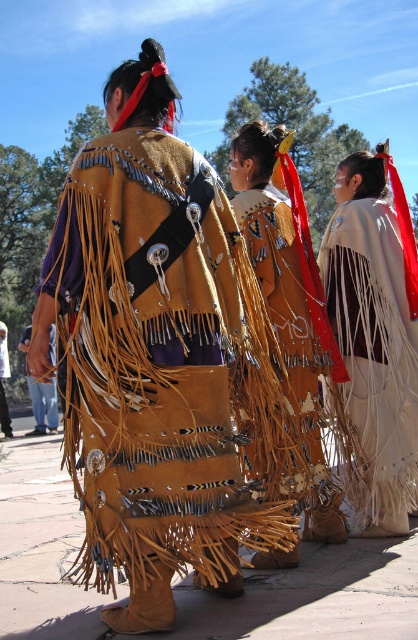
You are standing in front of the scene and want to touch the closest vest between the leather fringe vest at lower left and the brown suede vest at center. Which one can you reach first?

The leather fringe vest at lower left is closer to the viewer than the brown suede vest at center, so you can reach it first.

In the scene described, where is the leather fringe vest at center located in terms of coordinates?

The leather fringe vest at center is located at coordinates point (x=150, y=355).

Based on the scene description, which object is bigger between the leather fringe vest at lower left and the brown suede vest at center?

The leather fringe vest at lower left is larger in size compared to the brown suede vest at center.